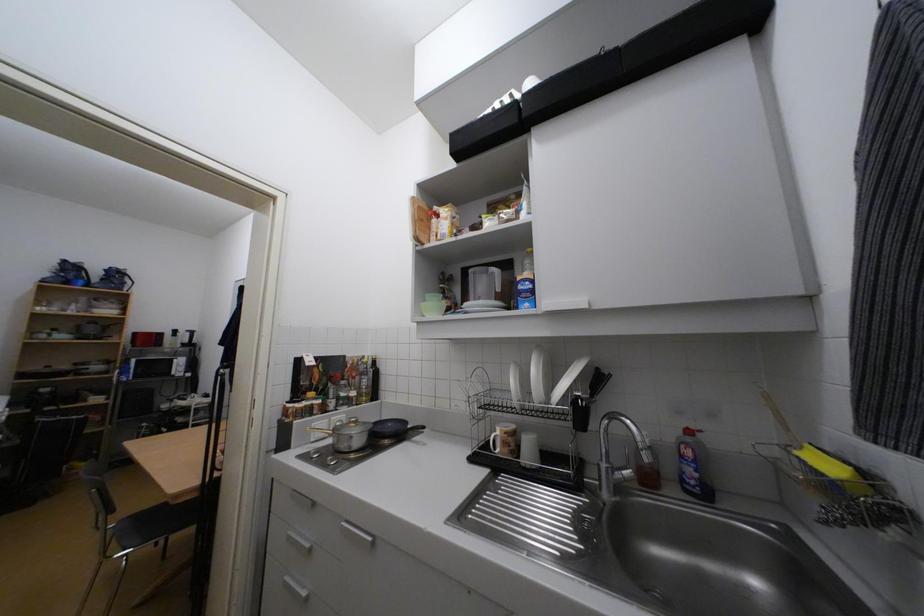
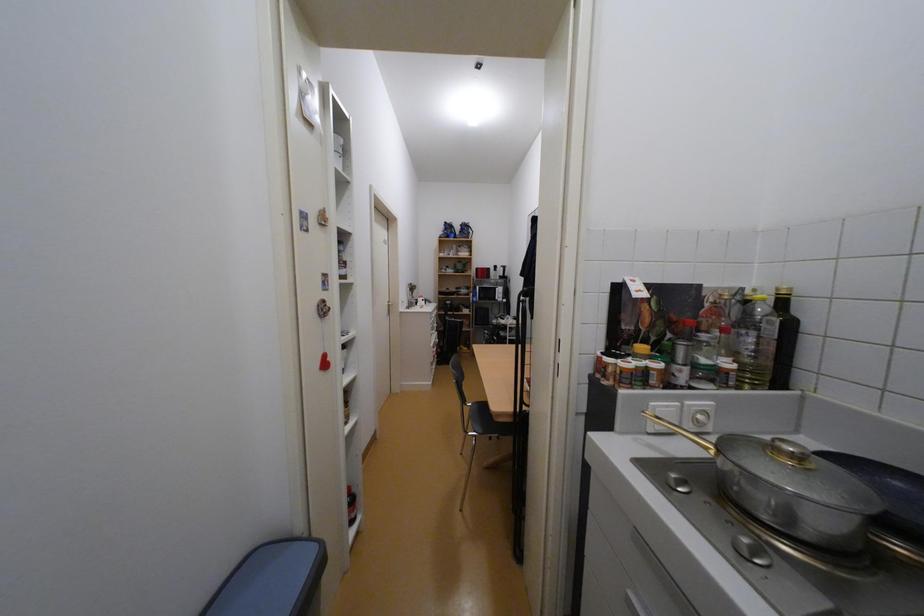
Question: The camera is either moving clockwise (left) or counter-clockwise (right) around the object. The first image is from the beginning of the video and the second image is from the end. Is the camera moving left or right when shooting the video?

Choices:
 (A) Left
 (B) Right

Answer: (B)